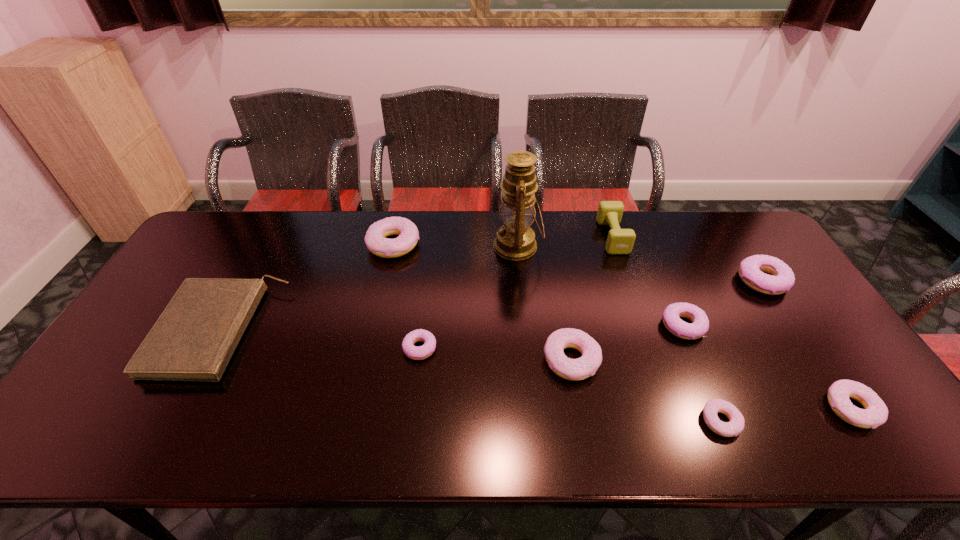
This screenshot has width=960, height=540. Find the location of `vacant space located on the left of the second smallest purple doughnut`. vacant space located on the left of the second smallest purple doughnut is located at coordinates (561, 326).

Where is `vacant space located on the back of the rightmost pink doughnut`? The image size is (960, 540). vacant space located on the back of the rightmost pink doughnut is located at coordinates (823, 366).

Where is `vacant space located 0.280m on the left of the smallest purple doughnut`? This screenshot has width=960, height=540. vacant space located 0.280m on the left of the smallest purple doughnut is located at coordinates (297, 348).

Locate an element on the screen. This screenshot has height=540, width=960. free space located on the right of the second pink doughnut from right to left is located at coordinates (800, 421).

Find the location of a particular element. oil lamp present at the far edge is located at coordinates (515, 240).

Find the location of a particular element. The width and height of the screenshot is (960, 540). dumbbell that is at the far edge is located at coordinates (619, 241).

Image resolution: width=960 pixels, height=540 pixels. In order to click on doughnut that is positioned at the far edge in this screenshot , I will do point(375,239).

Identify the location of object located at the left edge. This screenshot has height=540, width=960. (195, 337).

The width and height of the screenshot is (960, 540). I want to click on object located at the near right corner, so click(875, 413).

Find the location of `free space at the far edge of the desktop`. free space at the far edge of the desktop is located at coordinates (660, 217).